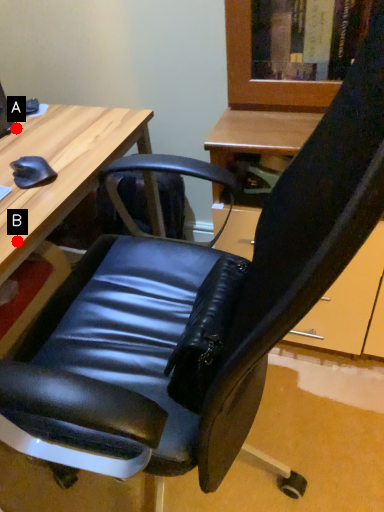
Question: Two points are circled on the image, labeled by A and B beside each circle. Which point is farther to the camera?

Choices:
 (A) A is further
 (B) B is further

Answer: (A)